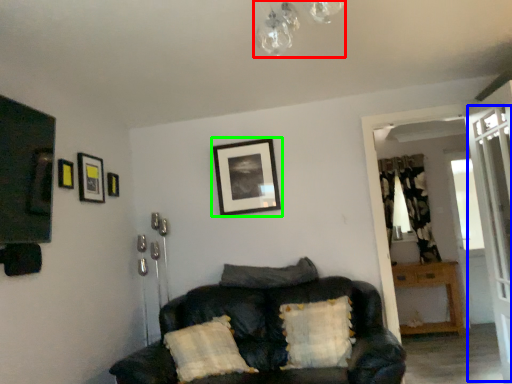
Question: Considering the real-world distances, which object is farthest from light fixture (highlighted by a red box)? screen door (highlighted by a blue box) or picture frame (highlighted by a green box)?

Choices:
 (A) screen door
 (B) picture frame

Answer: (A)